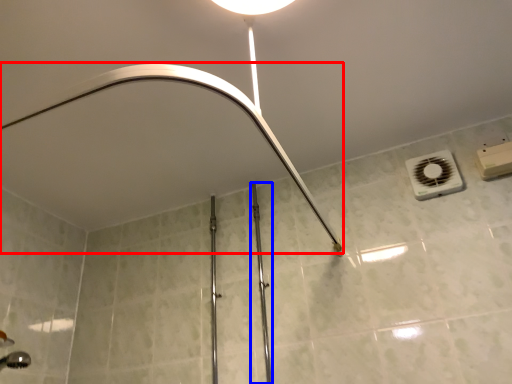
Question: Among these objects, which one is nearest to the camera, shower (highlighted by a red box) or rail (highlighted by a blue box)?

Choices:
 (A) shower
 (B) rail

Answer: (A)